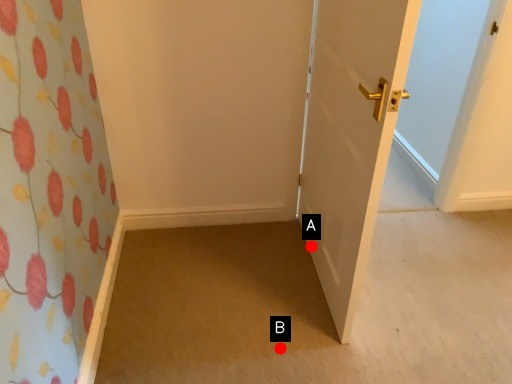
Question: Two points are circled on the image, labeled by A and B beside each circle. Which point is further to the camera?

Choices:
 (A) A is further
 (B) B is further

Answer: (A)